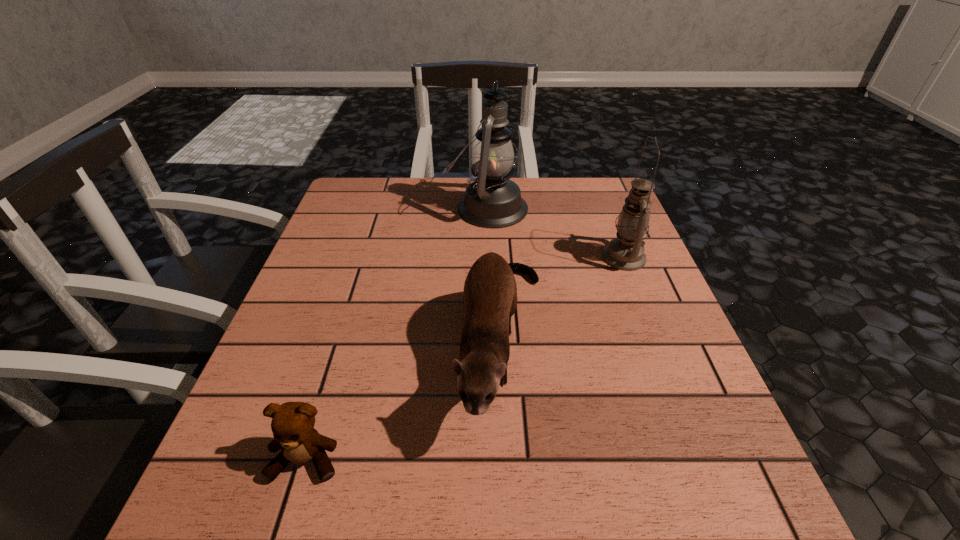
Locate an element on the screen. The height and width of the screenshot is (540, 960). the farthest object is located at coordinates (491, 200).

The image size is (960, 540). Find the location of `the farther oil lamp`. the farther oil lamp is located at coordinates (491, 200).

I want to click on the nearer oil lamp, so click(625, 252).

This screenshot has height=540, width=960. Identify the location of the rightmost object. (625, 252).

Locate an element on the screen. the second shortest object is located at coordinates (490, 293).

Find the location of a particular element. the shortest object is located at coordinates (292, 424).

This screenshot has height=540, width=960. In order to click on teddy bear in this screenshot , I will do `click(292, 424)`.

I want to click on blank area located on the front of the farthest object, so click(489, 311).

The width and height of the screenshot is (960, 540). In order to click on free space located on the back of the nearer oil lamp in this screenshot , I will do `click(611, 223)`.

Locate an element on the screen. This screenshot has width=960, height=540. blank space located 0.090m at the face of the third tallest object is located at coordinates pyautogui.click(x=511, y=524).